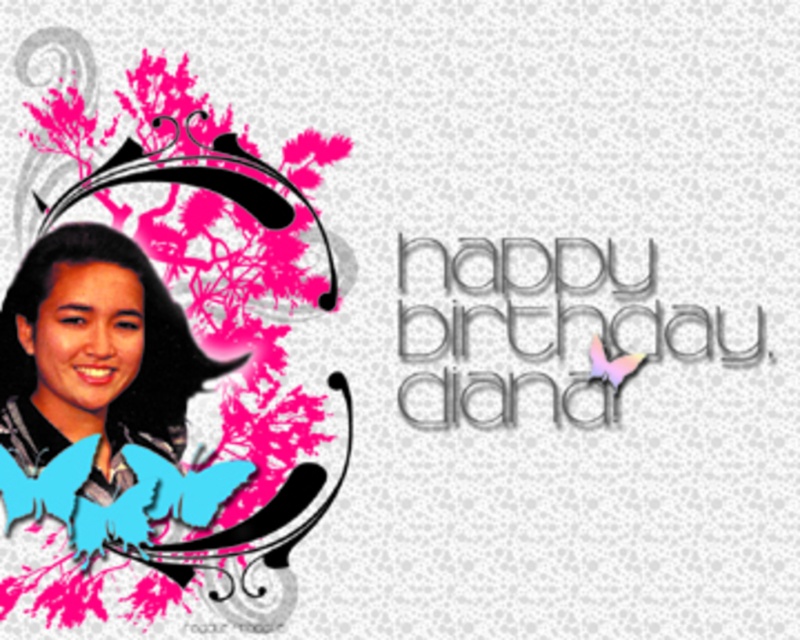
Identify the location of matte black portrait at left. The height and width of the screenshot is (640, 800). (204, 422).

Does matte black portrait at left have a larger size compared to metallic silver text at center?

Yes.

Can you confirm if matte black portrait at left is thinner than metallic silver text at center?

Indeed, matte black portrait at left has a lesser width compared to metallic silver text at center.

Measure the distance between matte black portrait at left and camera.

matte black portrait at left is 1.75 meters away from camera.

Locate an element on the screen. The image size is (800, 640). matte black portrait at left is located at coordinates (204, 422).

Does metallic silver text at center have a lesser height compared to matte black hair at left?

Yes.

Is metallic silver text at center below matte black hair at left?

No, metallic silver text at center is not below matte black hair at left.

I want to click on metallic silver text at center, so coord(548,330).